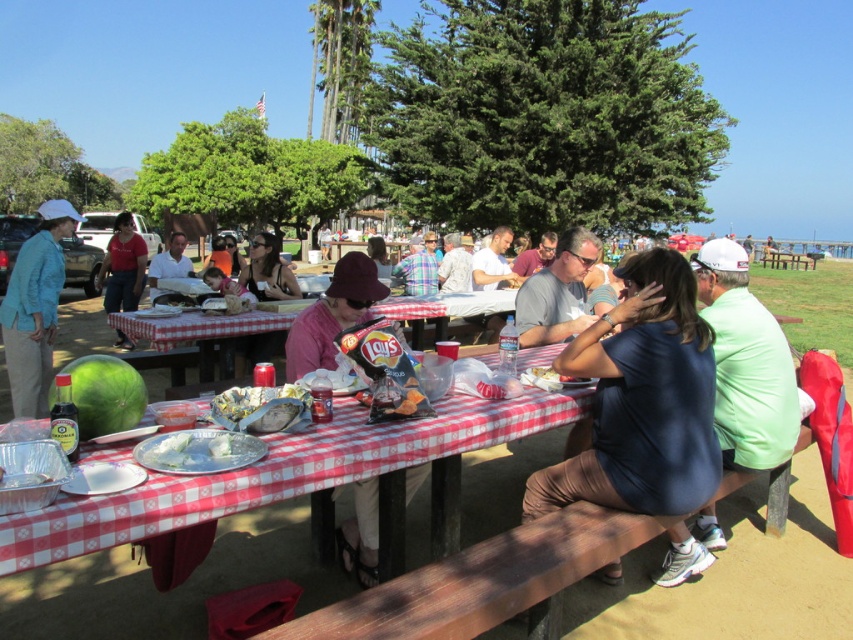
You are planning to wear both the pink fabric hat at center and the matte red shirt at center for a beach day. Based on the scene, which item would you need to adjust more to ensure it stays in place during windy conditions?

The pink fabric hat at center might be wider than matte red shirt at center, so it would need more adjustment to stay in place during windy conditions because wider items are more affected by wind.

You are at the picnic and want to find the blue fabric shirt at center. Which direction should you look relative to the matte blue jacket at left?

The blue fabric shirt at center is located to the right of the matte blue jacket at left, so you should look to the right of the matte blue jacket at left to find it.

You are organizing a photo shoot and need to ensure that two actors wearing the blue fabric shirt at center and the matte blue jacket at left can stand side by side without overlapping. Based on the scene description, which actor should stand on the left to maximize space?

The blue fabric shirt at center might be wider than matte blue jacket at left, so placing the actor in the blue fabric shirt at center on the left would allow more space between them since wider items should be placed on the outside to prevent overlap.